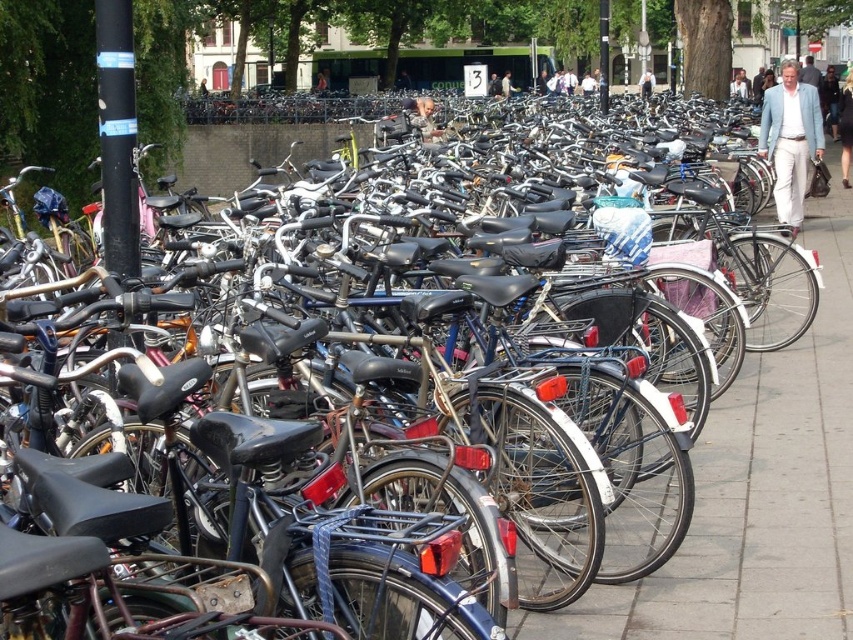
You are standing at the point marked as point (756,497) in the parking area. What type of surface are you currently standing on?

You are standing on smooth concrete pavement at center.

You are standing in the parking area looking at the bicycles. Which point, point (834, 444) or point (772, 122), is closer to you?

Point (834, 444) is closer to the viewer than point (772, 122).

You are standing at the entrance of the parking area and see the smooth concrete pavement at center and the light blue fabric jacket at center. Which object is nearer to you?

The smooth concrete pavement at center is closer to the viewer than the light blue fabric jacket at center.